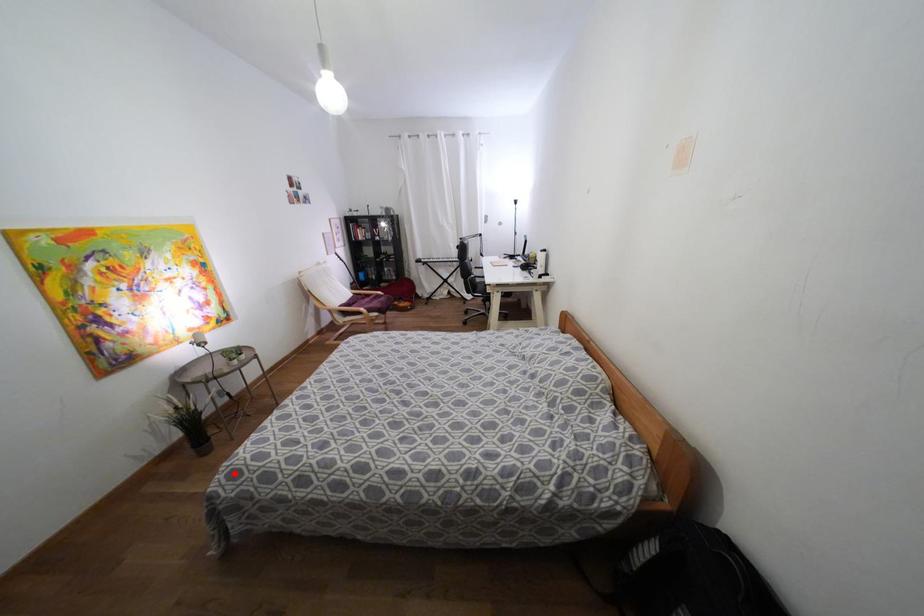
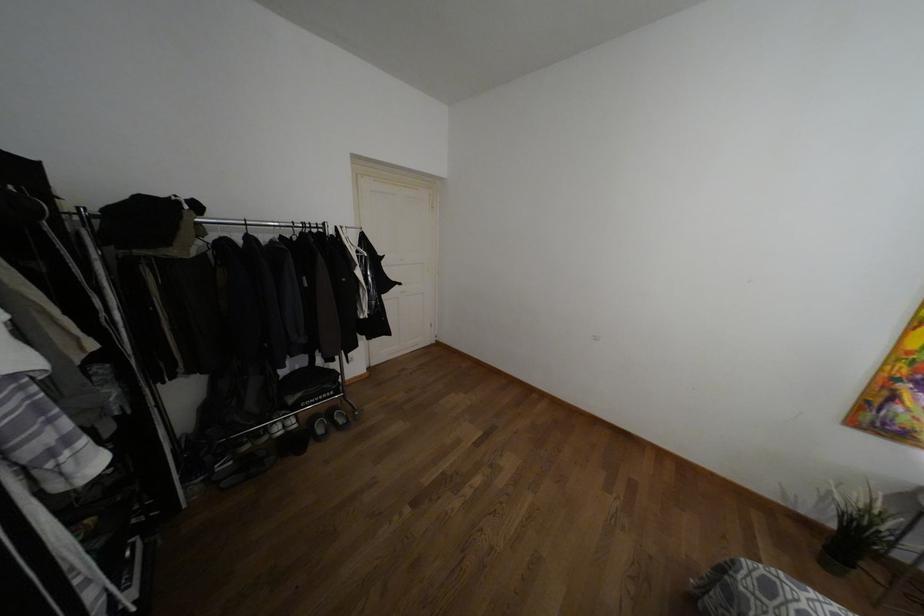
Find the pixel in the second image that matches the highlighted location in the first image.

(769, 588)